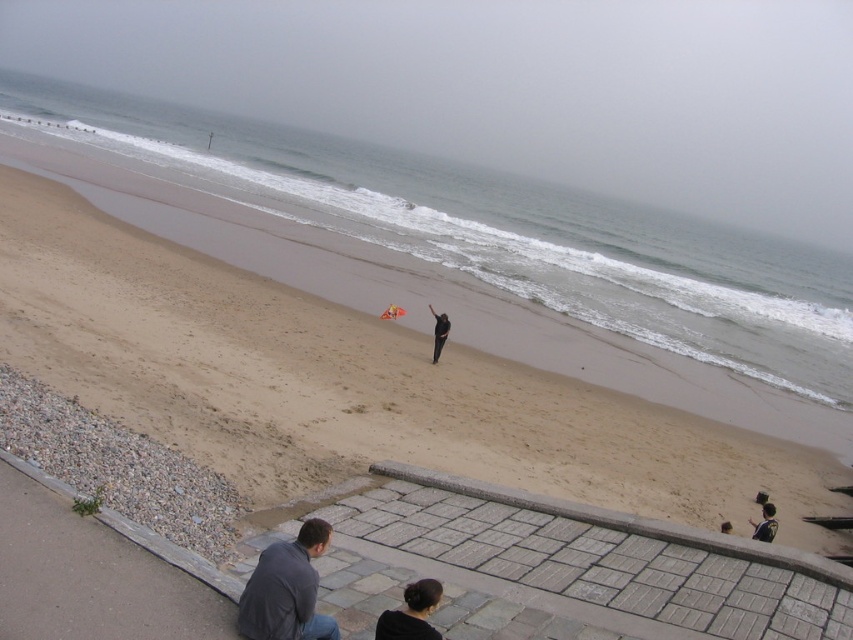
You are standing on the beach and see the orange fabric kite at center and the dark gray sweater at lower right. Which object is closer to the ocean?

The orange fabric kite at center is positioned over dark gray sweater at lower right, meaning it is closer to the ocean than the dark gray sweater at lower right.

You are planning to take a photo of the orange fabric kite at center and the dark gray sweater at lower right. Which object should you focus on first if you want to capture both in the same frame without moving the camera?

The orange fabric kite at center is much taller than the dark gray sweater at lower right, so you should focus on the orange fabric kite at center first to ensure it fits within the frame.

You are standing at the edge of the beach and see the dark gray fabric jacket at lower center. If you want to reach it without getting your feet wet, what is the minimum distance you need to walk?

The dark gray fabric jacket at lower center is 5.53 meters away from the viewer. To reach it without getting your feet wet, you need to walk at least 5.53 meters.